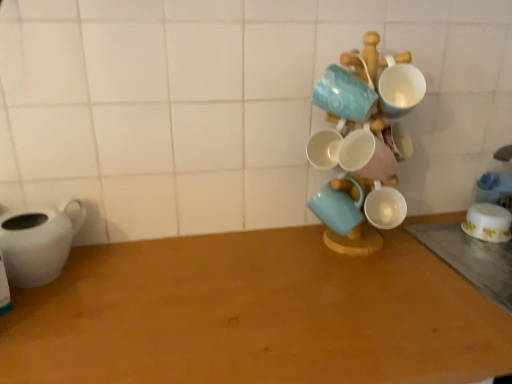
Image resolution: width=512 pixels, height=384 pixels. Find the location of `free location in front of white glossy mugs at center-right`. free location in front of white glossy mugs at center-right is located at coordinates (376, 297).